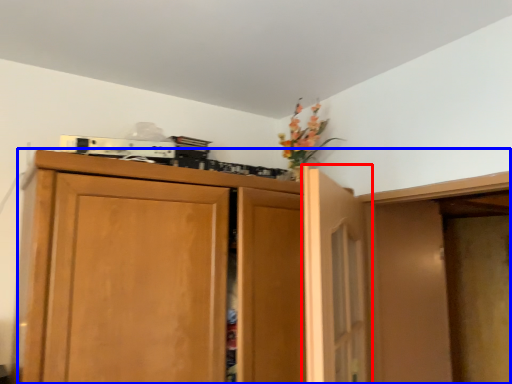
Question: Which object appears farthest to the camera in this image, door (highlighted by a red box) or cupboard (highlighted by a blue box)?

Choices:
 (A) door
 (B) cupboard

Answer: (B)